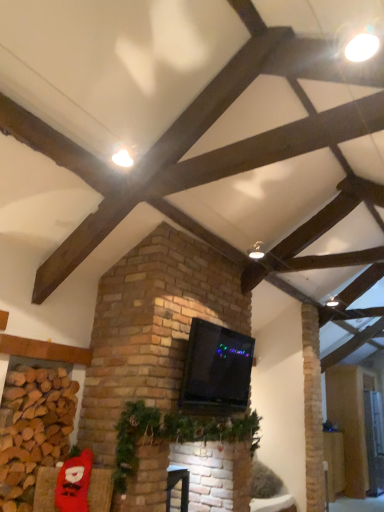
Question: Does black glossy tv at center appear on the right side of brown brick at lower left?

Choices:
 (A) no
 (B) yes

Answer: (B)

Question: Can you confirm if black glossy tv at center is smaller than brown brick at lower left?

Choices:
 (A) yes
 (B) no

Answer: (A)

Question: From the image's perspective, is black glossy tv at center located beneath brown brick at lower left?

Choices:
 (A) no
 (B) yes

Answer: (A)

Question: Is black glossy tv at center thinner than brown brick at lower left?

Choices:
 (A) yes
 (B) no

Answer: (A)

Question: Is black glossy tv at center not within brown brick at lower left?

Choices:
 (A) yes
 (B) no

Answer: (A)

Question: From the image's perspective, is green garland at center positioned above or below black glossy tv at center?

Choices:
 (A) above
 (B) below

Answer: (B)

Question: Is green garland at center situated inside black glossy tv at center or outside?

Choices:
 (A) inside
 (B) outside

Answer: (B)

Question: Considering the positions of green garland at center and black glossy tv at center in the image, is green garland at center wider or thinner than black glossy tv at center?

Choices:
 (A) thin
 (B) wide

Answer: (B)

Question: Is green garland at center taller or shorter than black glossy tv at center?

Choices:
 (A) short
 (B) tall

Answer: (A)

Question: Considering the positions of brown brick at lower left and green garland at center in the image, is brown brick at lower left wider or thinner than green garland at center?

Choices:
 (A) wide
 (B) thin

Answer: (B)

Question: Looking at the image, does brown brick at lower left seem bigger or smaller compared to green garland at center?

Choices:
 (A) big
 (B) small

Answer: (B)

Question: From a real-world perspective, is brown brick at lower left positioned above or below green garland at center?

Choices:
 (A) below
 (B) above

Answer: (B)

Question: Is point (1, 429) closer or farther from the camera than point (145, 415)?

Choices:
 (A) closer
 (B) farther

Answer: (A)

Question: Considering the positions of point (195, 412) and point (258, 241), is point (195, 412) closer or farther from the camera than point (258, 241)?

Choices:
 (A) closer
 (B) farther

Answer: (A)

Question: Considering the relative positions of black glossy tv at center and matte white ceiling light at upper center in the image provided, is black glossy tv at center to the left or to the right of matte white ceiling light at upper center?

Choices:
 (A) right
 (B) left

Answer: (B)